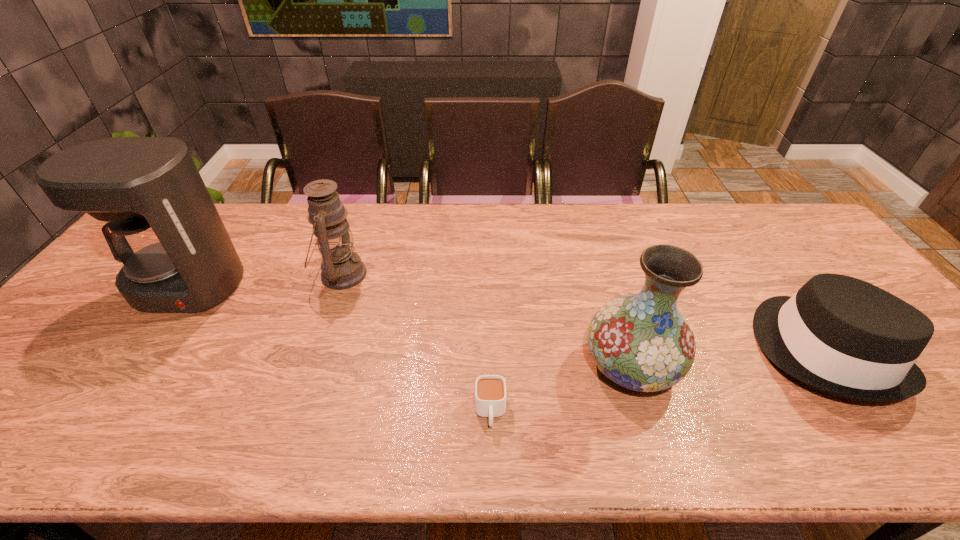
Find the location of a particular element. vacant position located 0.160m on the left of the oil lamp is located at coordinates (262, 274).

At what (x,y) coordinates should I click in order to perform the action: click on free spot located 0.050m on the left of the second shortest object. Please return your answer as a coordinate pair (x, y). Looking at the image, I should click on (738, 349).

The image size is (960, 540). In order to click on object located in the near edge section of the desktop in this screenshot , I will do pyautogui.click(x=490, y=390).

The image size is (960, 540). In order to click on object at the left edge in this screenshot , I will do `click(176, 256)`.

The image size is (960, 540). Find the location of `object situated at the right edge`. object situated at the right edge is located at coordinates [843, 336].

At what (x,y) coordinates should I click in order to perform the action: click on free space at the far edge of the desktop. Please return your answer as a coordinate pair (x, y). The height and width of the screenshot is (540, 960). Looking at the image, I should click on (716, 213).

At what (x,y) coordinates should I click in order to perform the action: click on free region at the near edge of the desktop. Please return your answer as a coordinate pair (x, y). Looking at the image, I should click on (207, 436).

This screenshot has height=540, width=960. I want to click on free space at the left edge of the desktop, so click(35, 418).

At what (x,y) coordinates should I click in order to perform the action: click on empty space between the coffee maker and the fourth object from left to right. Please return your answer as a coordinate pair (x, y). The image size is (960, 540). Looking at the image, I should click on (409, 326).

I want to click on vacant area between the rightmost object and the leftmost object, so click(505, 318).